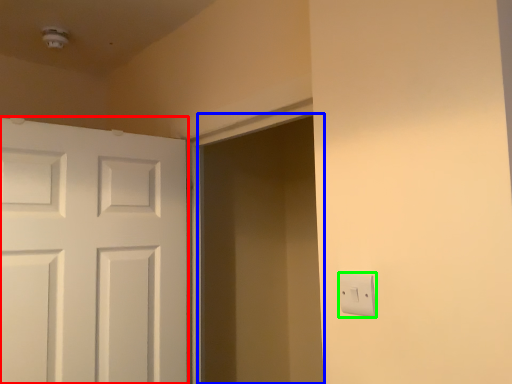
Question: Which is nearer to the door (highlighted by a red box)? screen door (highlighted by a blue box) or light switch (highlighted by a green box).

Choices:
 (A) screen door
 (B) light switch

Answer: (A)